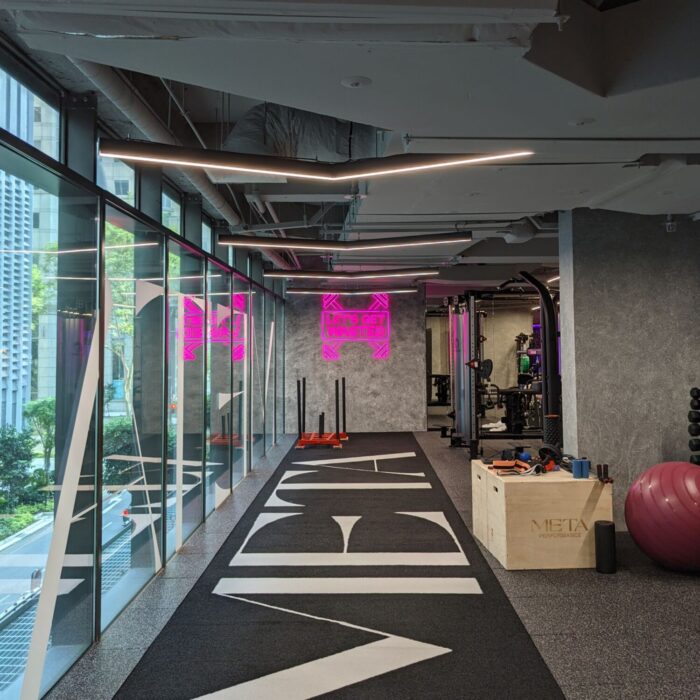
Locate an element on the screen. The height and width of the screenshot is (700, 700). flourescent ceiling lights is located at coordinates (330, 173), (337, 245), (344, 273), (348, 290).